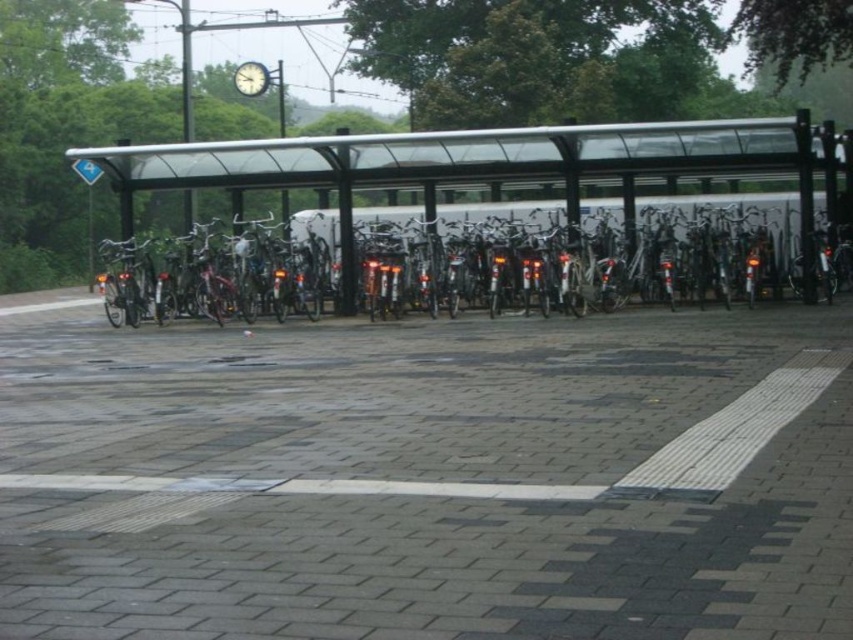
Does metallic silver bicycle at center lie behind metallic clock at upper center?

No, it is in front of metallic clock at upper center.

Which is more to the left, metallic silver bicycle at center or metallic clock at upper center?

From the viewer's perspective, metallic clock at upper center appears more on the left side.

You are a GUI agent. You are given a task and a screenshot of the screen. Output one action in this format:
    pyautogui.click(x=<x>, y=<y>)
    Task: Click on the metallic silver bicycle at center
    
    Given the screenshot: What is the action you would take?
    pyautogui.click(x=730, y=218)